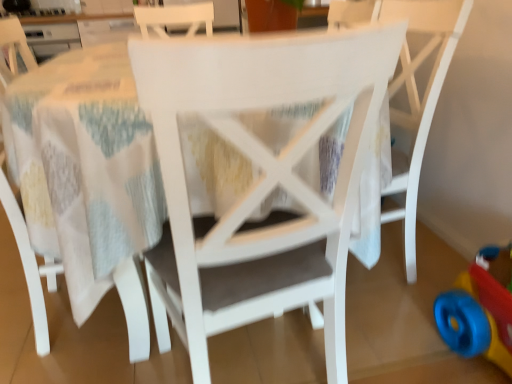
Question: In which direction should I rotate to look at white matte chair at center, the 1th chair positioned from the right?

Choices:
 (A) right
 (B) left

Answer: (A)

Question: Can you confirm if rubberized plastic toy at lower right is thinner than white matte chair at center, the 1th chair positioned from the right?

Choices:
 (A) yes
 (B) no

Answer: (A)

Question: Considering the relative positions of rubberized plastic toy at lower right and white matte chair at center, the 1th chair positioned from the right, in the image provided, is rubberized plastic toy at lower right to the left of white matte chair at center, the 1th chair positioned from the right, from the viewer's perspective?

Choices:
 (A) no
 (B) yes

Answer: (A)

Question: Is rubberized plastic toy at lower right looking in the opposite direction of white matte chair at center, which is the third chair in left-to-right order?

Choices:
 (A) no
 (B) yes

Answer: (A)

Question: Is rubberized plastic toy at lower right positioned in front of white matte chair at center, which is the third chair in left-to-right order?

Choices:
 (A) no
 (B) yes

Answer: (B)

Question: Could you tell me if rubberized plastic toy at lower right is facing white matte chair at center, which is the third chair in left-to-right order?

Choices:
 (A) no
 (B) yes

Answer: (A)

Question: Does rubberized plastic toy at lower right have a greater width compared to white matte chair at center, the 1th chair positioned from the right?

Choices:
 (A) no
 (B) yes

Answer: (A)

Question: From a real-world perspective, is white matte chair at center, which is the 2th chair in right-to-left order, located beneath white matte chair at center, which ranks as the third chair in right-to-left order?

Choices:
 (A) no
 (B) yes

Answer: (B)

Question: Considering the relative sizes of white matte chair at center, which is the 2th chair in right-to-left order, and white matte chair at center, which ranks as the third chair in right-to-left order, in the image provided, is white matte chair at center, which is the 2th chair in right-to-left order, thinner than white matte chair at center, which ranks as the third chair in right-to-left order,?

Choices:
 (A) yes
 (B) no

Answer: (B)

Question: Is white matte chair at center, which is the second chair from left to right, positioned behind white matte chair at center, which is the 1th chair in left-to-right order?

Choices:
 (A) no
 (B) yes

Answer: (A)

Question: From the image's perspective, is white matte chair at center, which is the 2th chair in right-to-left order, on white matte chair at center, which is the 1th chair in left-to-right order?

Choices:
 (A) yes
 (B) no

Answer: (B)

Question: From a real-world perspective, is white matte chair at center, which is the second chair from left to right, on top of white matte chair at center, which ranks as the third chair in right-to-left order?

Choices:
 (A) no
 (B) yes

Answer: (A)

Question: Is white matte chair at center, which is the 2th chair in right-to-left order, to the left of white matte chair at center, which ranks as the third chair in right-to-left order, from the viewer's perspective?

Choices:
 (A) no
 (B) yes

Answer: (A)

Question: Can you confirm if white matte chair at center, which ranks as the third chair in right-to-left order, is positioned to the right of white matte chair at center, which is the second chair from left to right?

Choices:
 (A) no
 (B) yes

Answer: (A)